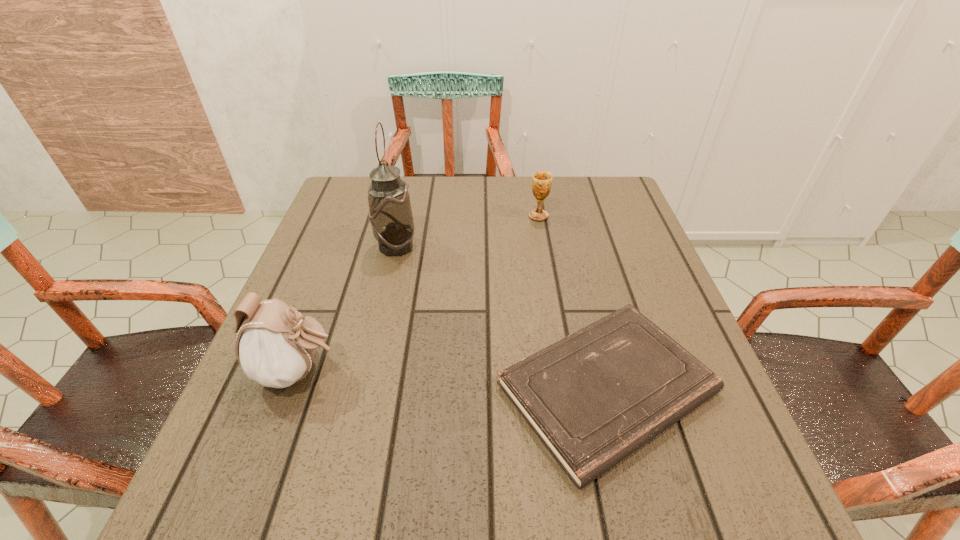
Locate an element on the screen. vacant area between the shortest object and the chalice is located at coordinates (573, 302).

Identify which object is the third nearest to the pouch. Please provide its 2D coordinates. Your answer should be formatted as a tuple, i.e. [(x, y)], where the tuple contains the x and y coordinates of a point satisfying the conditions above.

[(541, 184)]

Select which object appears as the second closest to the shortest object. Please provide its 2D coordinates. Your answer should be formatted as a tuple, i.e. [(x, y)], where the tuple contains the x and y coordinates of a point satisfying the conditions above.

[(275, 347)]

Locate an element on the screen. Image resolution: width=960 pixels, height=540 pixels. free point that satisfies the following two spatial constraints: 1. on the front side of the paperback book; 2. on the left side of the third nearest object is located at coordinates (363, 388).

Identify the location of free space that satisfies the following two spatial constraints: 1. on the front side of the chalice; 2. on the front-facing side of the pouch. This screenshot has width=960, height=540. (565, 371).

The width and height of the screenshot is (960, 540). In order to click on free space that satisfies the following two spatial constraints: 1. on the front side of the tallest object; 2. on the left side of the paperback book in this screenshot , I will do `click(363, 388)`.

This screenshot has width=960, height=540. Find the location of `vacant area that satisfies the following two spatial constraints: 1. on the front-facing side of the pouch; 2. on the right side of the paperback book`. vacant area that satisfies the following two spatial constraints: 1. on the front-facing side of the pouch; 2. on the right side of the paperback book is located at coordinates (293, 388).

Locate an element on the screen. vacant space that satisfies the following two spatial constraints: 1. on the back side of the farthest object; 2. on the right side of the third nearest object is located at coordinates (402, 216).

Locate an element on the screen. The width and height of the screenshot is (960, 540). vacant space that satisfies the following two spatial constraints: 1. on the front side of the paperback book; 2. on the left side of the chalice is located at coordinates (568, 388).